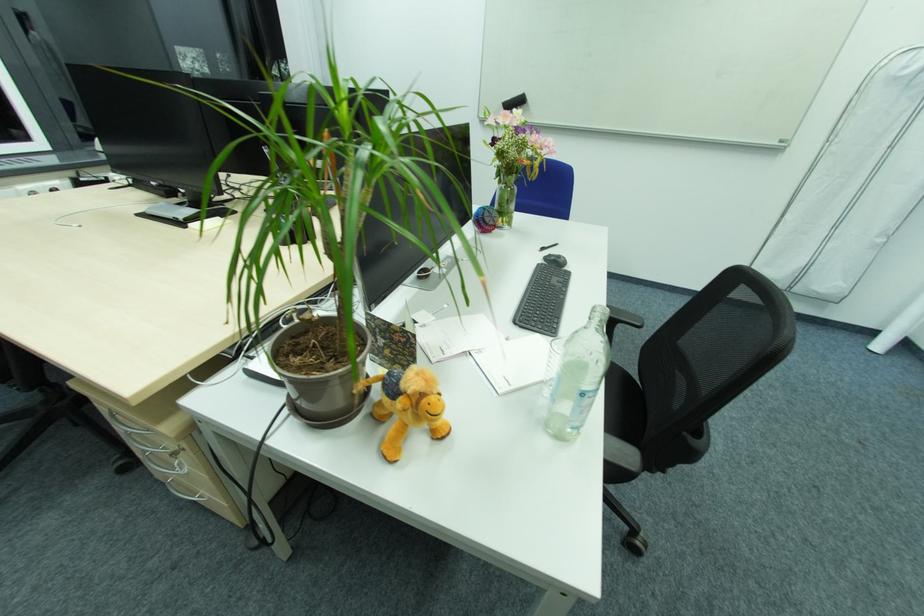
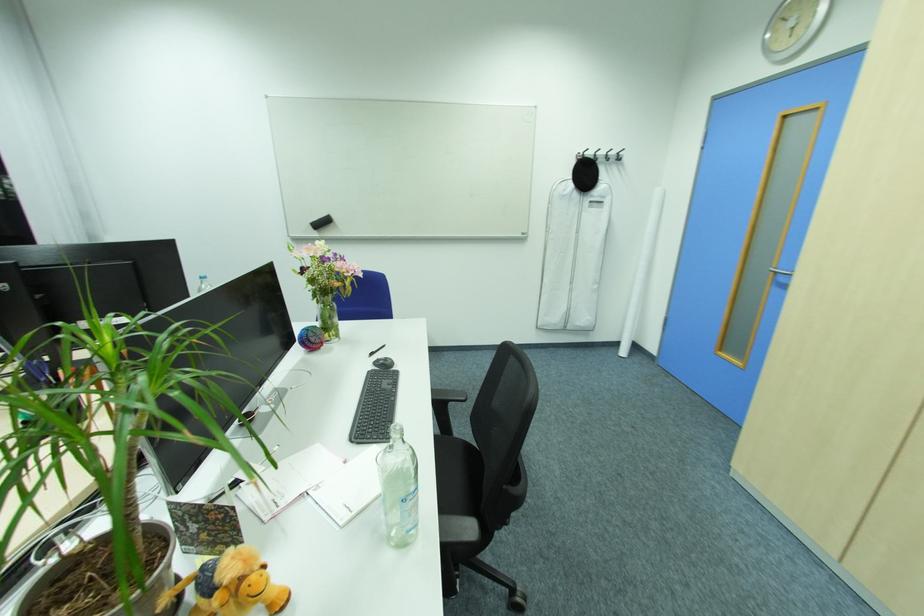
Question: The images are taken continuously from a first-person perspective. In which direction is your viewpoint rotating?

Choices:
 (A) Left
 (B) Right
 (C) Up
 (D) Down

Answer: (B)